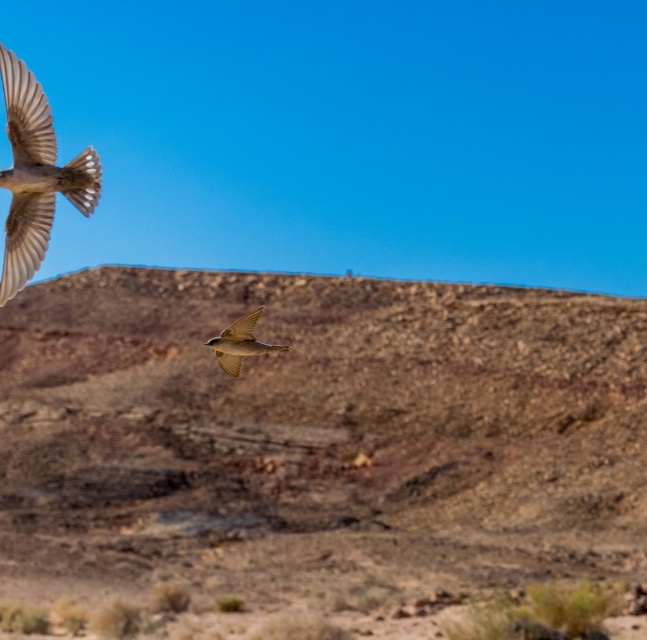
Question: Which object is farther from the camera taking this photo?

Choices:
 (A) brown feathered bird at center
 (B) brown feathered bird at upper left

Answer: (A)

Question: Is brown feathered bird at upper left below brown feathered bird at center?

Choices:
 (A) yes
 (B) no

Answer: (B)

Question: Which of the following is the farthest from the observer?

Choices:
 (A) brown feathered bird at upper left
 (B) brown rocky terrain at center

Answer: (B)

Question: Is brown feathered bird at upper left to the left of brown feathered bird at center from the viewer's perspective?

Choices:
 (A) no
 (B) yes

Answer: (B)

Question: Considering the relative positions of brown rocky terrain at center and brown feathered bird at center in the image provided, where is brown rocky terrain at center located with respect to brown feathered bird at center?

Choices:
 (A) right
 (B) left

Answer: (A)

Question: Which point appears farthest from the camera in this image?

Choices:
 (A) (391, 451)
 (B) (17, 115)

Answer: (A)